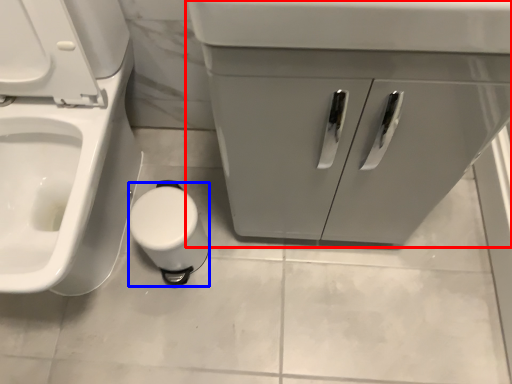
Question: Which of the following is the farthest to the observer, bathroom cabinet (highlighted by a red box) or toilet paper (highlighted by a blue box)?

Choices:
 (A) bathroom cabinet
 (B) toilet paper

Answer: (B)